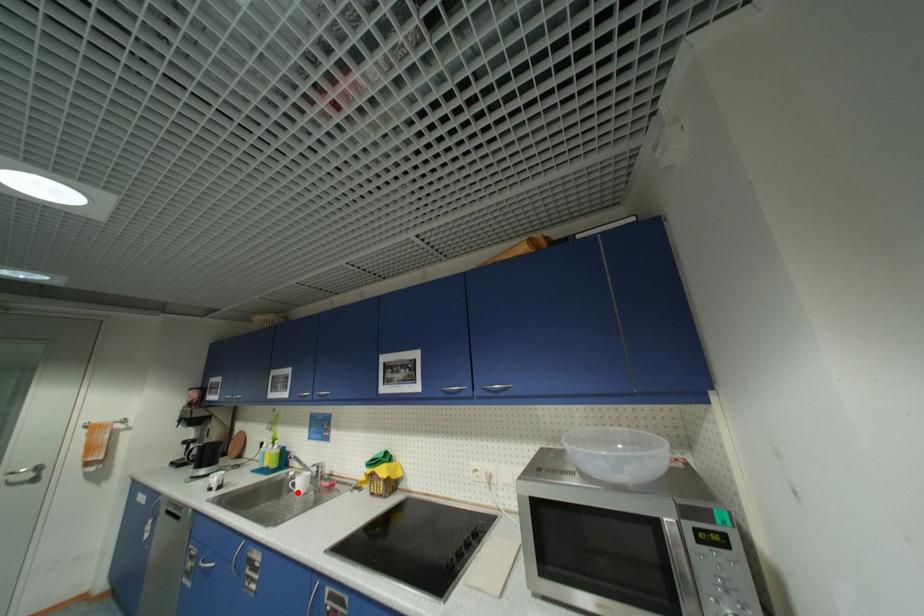
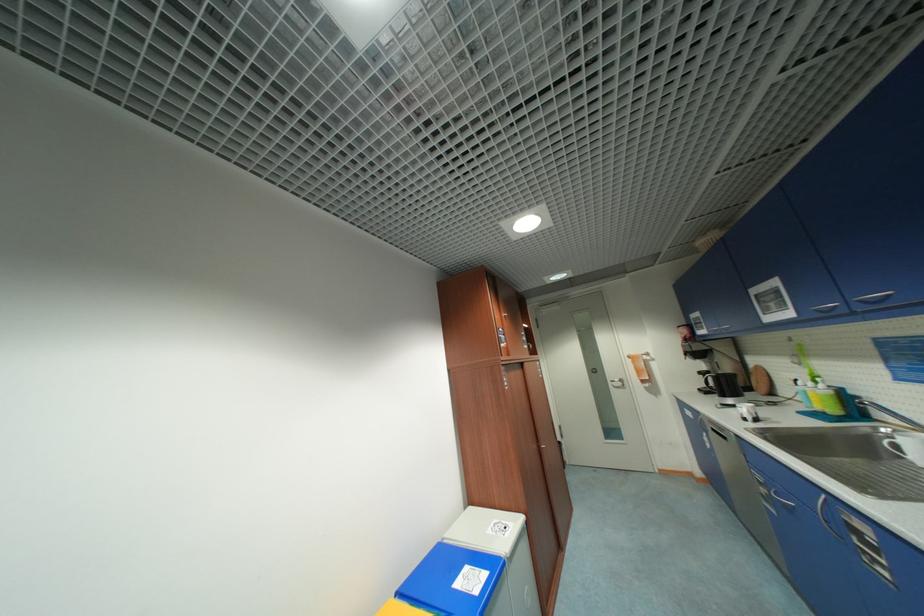
Where in the second image is the point corresponding to the highlighted location from the first image?

(906, 458)